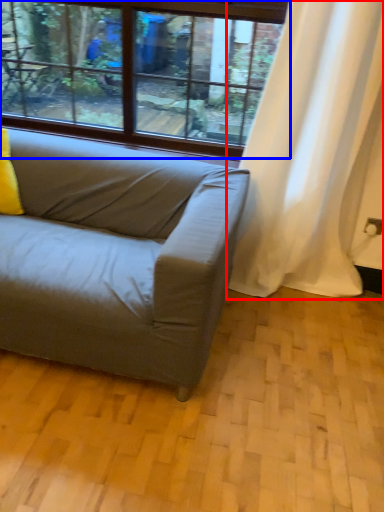
Question: Which object is further to the camera taking this photo, curtain (highlighted by a red box) or window (highlighted by a blue box)?

Choices:
 (A) curtain
 (B) window

Answer: (B)